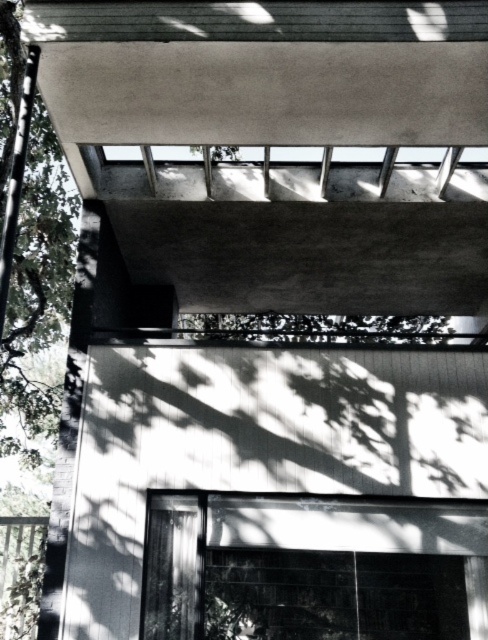
In the scene shown: You are standing at the base of the modern house looking up. There are two points marked on the structure. The first is at coordinate point (9, 300) and the second is at coordinate point (381, 330). From your perspective, which point is closer to you?

Point (9, 300) is in front of point (381, 330), so it is closer to you.

Consider the image. You are a photographer planning to take a wide shot of the modern house. You notice two green leafy trees in the scene. Which tree, the green leafy tree at left or the green leafy tree at center, will appear wider in the photo?

The green leafy tree at left appears wider in the photo because its width is larger than the green leafy tree at center.

You are standing at the base of the building and looking up. Which direction should you turn to see the green leafy tree at left?

You should turn to the left to see the green leafy tree at left since it is located at the left side of the image as per its coordinates.